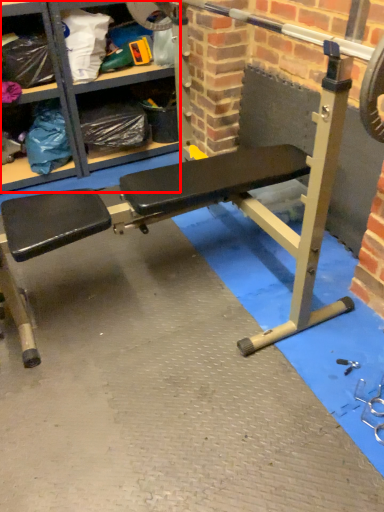
Question: From the image's perspective, where is shelf (annotated by the red box) located in relation to barbell in the image?

Choices:
 (A) above
 (B) below

Answer: (A)